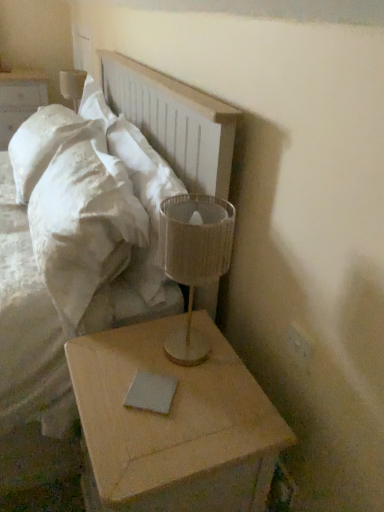
Identify the location of free space above light wood/roughnightstand at lower right, the 1th nightstand viewed from the front (from a real-world perspective). This screenshot has height=512, width=384. (177, 387).